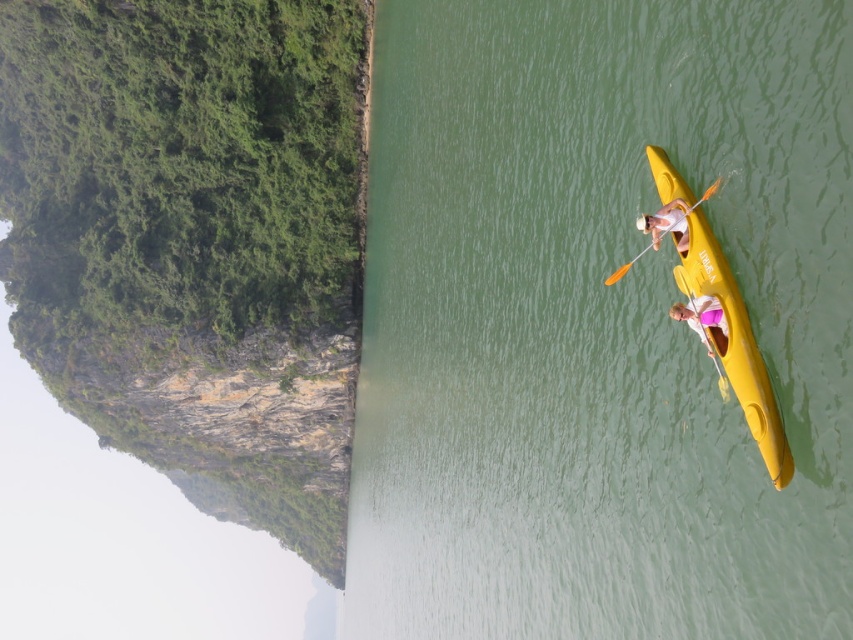
Looking at this image, you are a photographer positioned on the shore of the lake. You want to take a photo of both the green rubber kayak at right and the yellow plastic kayak at right in the same frame. Given that your camera has a maximum focal length that allows capturing objects up to 40 meters apart, will you be able to include both kayaks in a single photo?

The green rubber kayak at right is 38.13 meters from the yellow plastic kayak at right. Since the distance between them is less than the camera maximum focal length of 40 meters, you can include both kayaks in a single photo.

You are a photographer trying to capture the kayakers. You have a camera with a zoom lens that can focus on objects up to 10 meters away. The green rubber kayak at right and the pink fabric at right are both in your field of view. Which object is larger in the photo?

The green rubber kayak at right is bigger than the pink fabric at right, so it will appear larger in the photo.